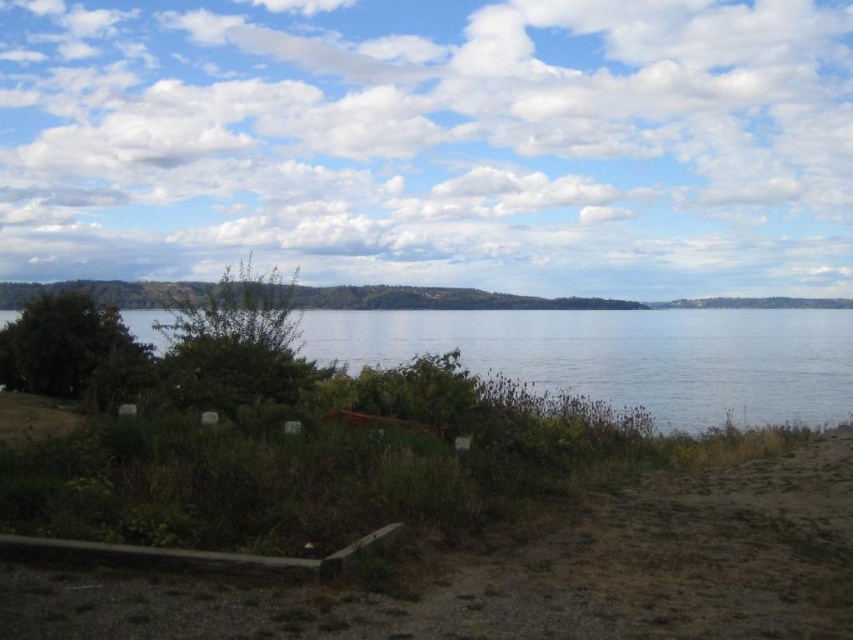
Does white fluffy cloud at upper center appear on the right side of green grass at lower center?

In fact, white fluffy cloud at upper center is to the left of green grass at lower center.

Image resolution: width=853 pixels, height=640 pixels. What do you see at coordinates (432, 141) in the screenshot?
I see `white fluffy cloud at upper center` at bounding box center [432, 141].

The width and height of the screenshot is (853, 640). What are the coordinates of `white fluffy cloud at upper center` in the screenshot? It's located at (432, 141).

Is point (129, 188) positioned before point (344, 321)?

No, (129, 188) is further to viewer.

Does white fluffy cloud at upper center appear over clear water at center?

Yes, white fluffy cloud at upper center is above clear water at center.

Is point (798, 4) positioned in front of point (811, 362)?

No, (798, 4) is behind (811, 362).

I want to click on white fluffy cloud at upper center, so click(432, 141).

Measure the distance from green grass at lower center to clear water at center.

green grass at lower center and clear water at center are 92.05 feet apart from each other.

Who is shorter, green grass at lower center or clear water at center?

With less height is green grass at lower center.

Where is `green grass at lower center`? The image size is (853, 640). green grass at lower center is located at coordinates (527, 573).